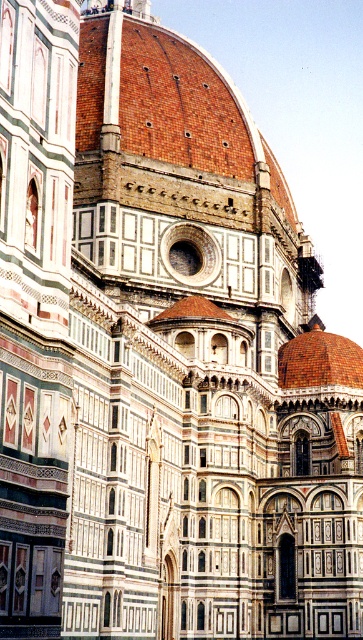
How much distance is there between terracotta brick dome at center and brown tiled dome at center?

They are 20.90 meters apart.

Does terracotta brick dome at center appear over brown tiled dome at center?

Yes.

Image resolution: width=363 pixels, height=640 pixels. I want to click on terracotta brick dome at center, so (x=180, y=104).